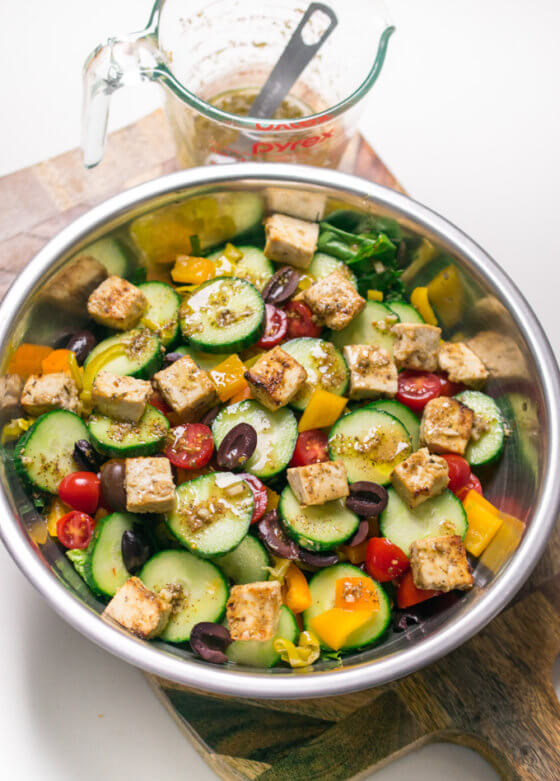
This screenshot has width=560, height=781. Identify the location of pyrex handle. (94, 116).